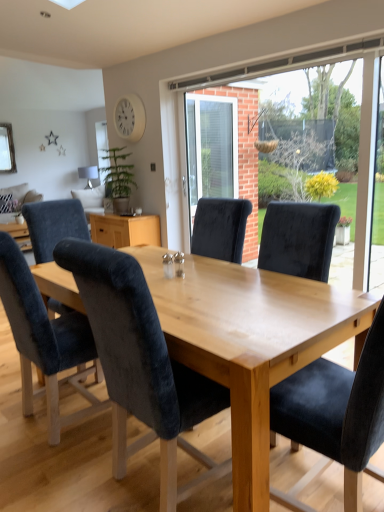
Question: Is matte silver lamp at upper left facing towards transparent glass window at center?

Choices:
 (A) yes
 (B) no

Answer: (B)

Question: Can you confirm if matte silver lamp at upper left is thinner than transparent glass window at center?

Choices:
 (A) yes
 (B) no

Answer: (B)

Question: Is the surface of matte silver lamp at upper left in direct contact with transparent glass window at center?

Choices:
 (A) no
 (B) yes

Answer: (A)

Question: Considering the relative sizes of matte silver lamp at upper left and transparent glass window at center in the image provided, is matte silver lamp at upper left shorter than transparent glass window at center?

Choices:
 (A) no
 (B) yes

Answer: (B)

Question: Can transparent glass window at center be found inside matte silver lamp at upper left?

Choices:
 (A) no
 (B) yes

Answer: (A)

Question: From a real-world perspective, is matte silver lamp at upper left over transparent glass window at center?

Choices:
 (A) yes
 (B) no

Answer: (B)

Question: Is velvet black chair at center, placed as the first chair when sorted from front to back, to the right of velvet blue couch at left from the viewer's perspective?

Choices:
 (A) no
 (B) yes

Answer: (B)

Question: Is velvet black chair at center, placed as the first chair when sorted from front to back, oriented away from velvet blue couch at left?

Choices:
 (A) no
 (B) yes

Answer: (A)

Question: From a real-world perspective, is velvet black chair at center, the fourth chair positioned from the back, positioned over velvet blue couch at left based on gravity?

Choices:
 (A) yes
 (B) no

Answer: (B)

Question: Does velvet black chair at center, the fourth chair positioned from the back, turn towards velvet blue couch at left?

Choices:
 (A) yes
 (B) no

Answer: (B)

Question: Is velvet black chair at center, placed as the first chair when sorted from front to back, surrounding velvet blue couch at left?

Choices:
 (A) no
 (B) yes

Answer: (A)

Question: Is velvet black chair at center, the 1th chair when ordered from right to left, outside velvet blue couch at left?

Choices:
 (A) no
 (B) yes

Answer: (B)

Question: Is velvet black chair at center, the fourth chair positioned from the back, next to white matte clock at upper center?

Choices:
 (A) no
 (B) yes

Answer: (A)